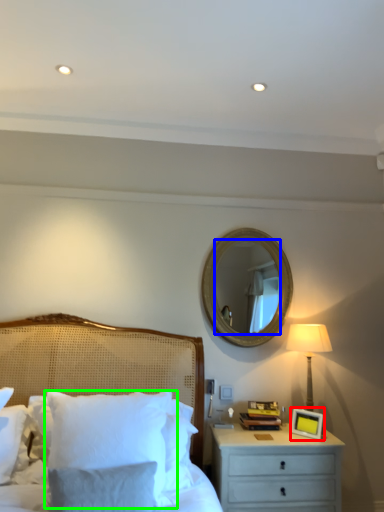
Question: Which object is positioned farthest from picture frame (highlighted by a red box)? Select from mirror (highlighted by a blue box) and pillow (highlighted by a green box).

Choices:
 (A) mirror
 (B) pillow

Answer: (A)